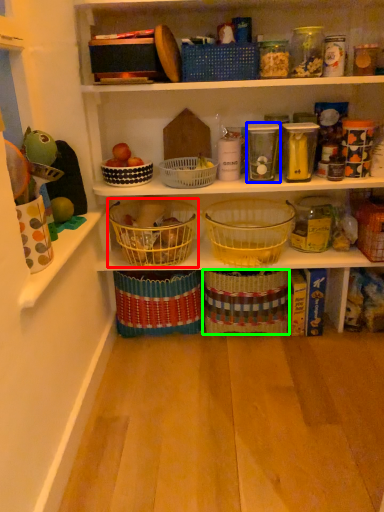
Question: Which object is the closest to the basket (highlighted by a red box)? Choose among these: glass jar (highlighted by a blue box) or basket (highlighted by a green box).

Choices:
 (A) glass jar
 (B) basket

Answer: (B)